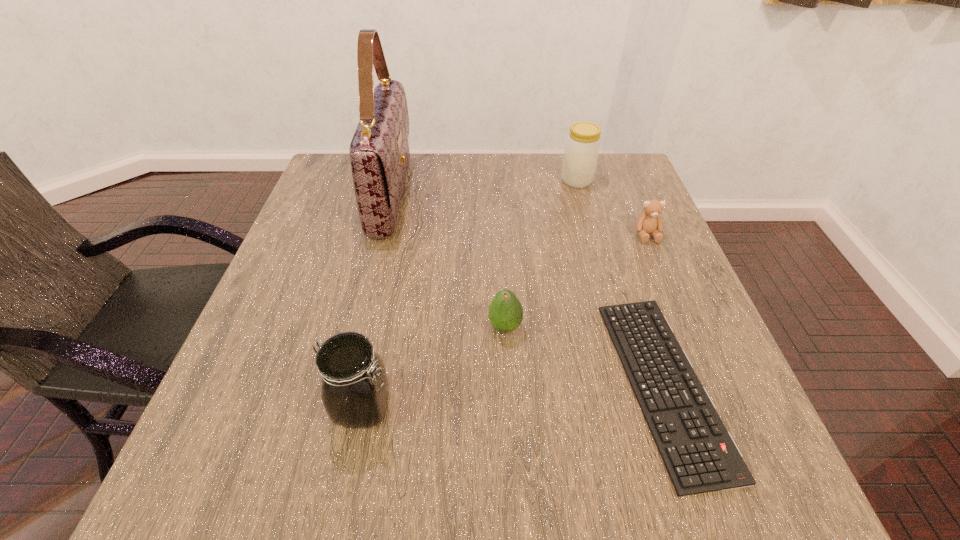
The height and width of the screenshot is (540, 960). I want to click on the tallest object, so click(379, 152).

What are the coordinates of `the right jar` in the screenshot? It's located at (582, 147).

The width and height of the screenshot is (960, 540). Find the location of `the left jar`. the left jar is located at coordinates (354, 388).

I want to click on the third object from left to right, so click(x=505, y=311).

Find the location of a particular element. Image resolution: width=960 pixels, height=540 pixels. teddy bear is located at coordinates (649, 222).

Where is `computer keyboard`? computer keyboard is located at coordinates (700, 455).

Find the location of a particular element. The image size is (960, 540). free space located 0.240m on the front of the tallest object with the clasp is located at coordinates (499, 194).

The height and width of the screenshot is (540, 960). I want to click on free spot located on the right of the farther jar, so click(639, 180).

Find the location of a particular element. free space located 0.150m on the lid of the nearer jar is located at coordinates pos(486,407).

Locate an element on the screen. The width and height of the screenshot is (960, 540). free region located on the back of the fourth object from right to left is located at coordinates (501, 245).